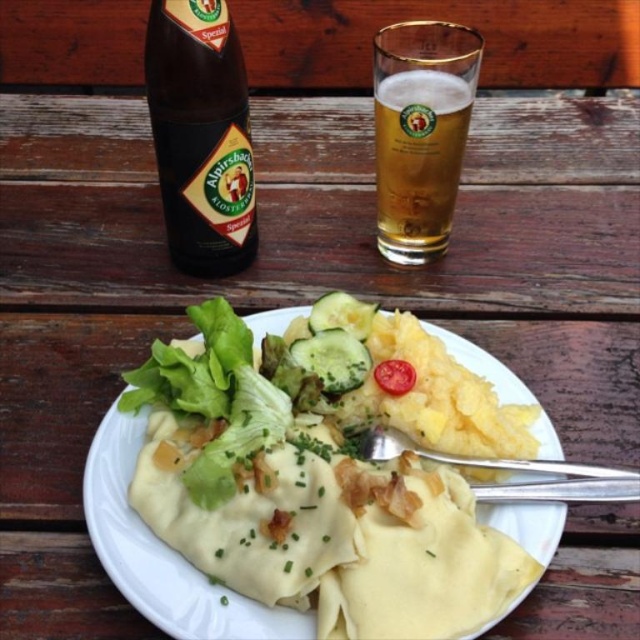
Question: Considering the real-world distances, which object is farthest from the red smooth tomato at plate center?

Choices:
 (A) dark brown glass bottle at upper left
 (B) white creamy dumplings at center
 (C) golden glass beer at upper center

Answer: (A)

Question: Can you confirm if dark brown glass bottle at upper left is wider than red smooth tomato at plate center?

Choices:
 (A) no
 (B) yes

Answer: (B)

Question: Is dark brown glass bottle at upper left to the left of red smooth tomato at plate center from the viewer's perspective?

Choices:
 (A) yes
 (B) no

Answer: (A)

Question: Considering the real-world distances, which object is closest to the red smooth tomato at plate center?

Choices:
 (A) dark brown glass bottle at upper left
 (B) golden glass beer at upper center

Answer: (B)

Question: Which point is farther to the camera?

Choices:
 (A) red smooth tomato at plate center
 (B) golden glass beer at upper center
 (C) dark brown glass bottle at upper left

Answer: (B)

Question: Can you confirm if golden glass beer at upper center is positioned to the left of red smooth tomato at plate center?

Choices:
 (A) no
 (B) yes

Answer: (A)